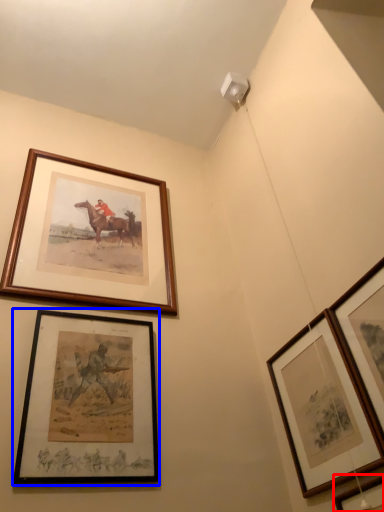
Question: Among these objects, which one is nearest to the camera, picture frame (highlighted by a red box) or picture frame (highlighted by a blue box)?

Choices:
 (A) picture frame
 (B) picture frame

Answer: (A)